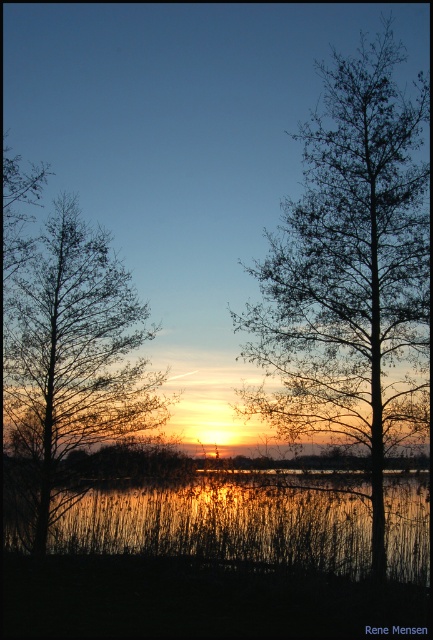
Question: Among these points, which one is nearest to the camera?

Choices:
 (A) (393, 333)
 (B) (60, 394)
 (C) (293, 492)

Answer: (C)

Question: Which object is farther from the camera taking this photo?

Choices:
 (A) reflective glass water at center
 (B) bare branches at center
 (C) silhouette bare tree at left

Answer: (C)

Question: Which of the following is the closest to the observer?

Choices:
 (A) (83, 499)
 (B) (142, 426)
 (C) (323, 266)

Answer: (C)

Question: Is bare branches at center smaller than silhouette bare tree at left?

Choices:
 (A) no
 (B) yes

Answer: (B)

Question: Does bare branches at center have a larger size compared to reflective glass water at center?

Choices:
 (A) yes
 (B) no

Answer: (B)

Question: Does bare branches at center lie behind silhouette bare tree at left?

Choices:
 (A) yes
 (B) no

Answer: (B)